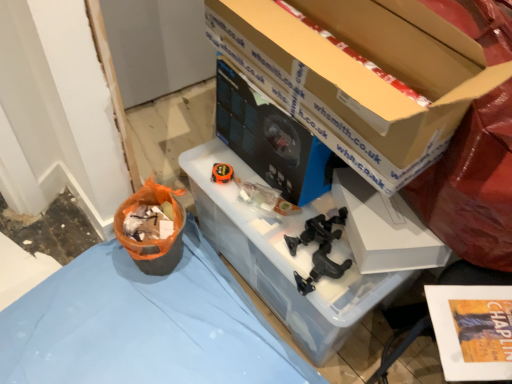
Image resolution: width=512 pixels, height=384 pixels. Find the location of `free area in between orange rubber tape measure at center, which appears as the 2th toy when viewed from the front, and black plastic clamps at center, positioned as the first toy in bottom-to-top order`. free area in between orange rubber tape measure at center, which appears as the 2th toy when viewed from the front, and black plastic clamps at center, positioned as the first toy in bottom-to-top order is located at coordinates (x=252, y=213).